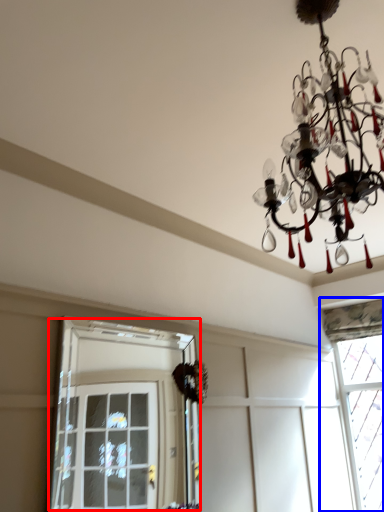
Question: Which object is further to the camera taking this photo, window (highlighted by a red box) or window (highlighted by a blue box)?

Choices:
 (A) window
 (B) window

Answer: (B)